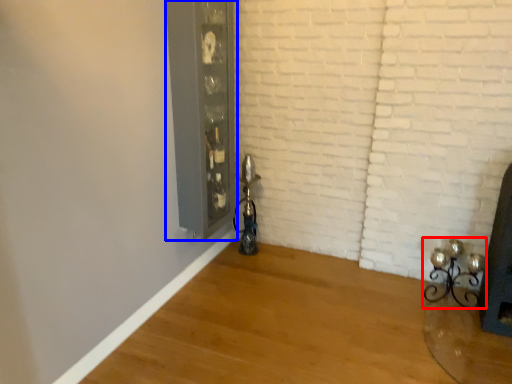
Question: Which object is further to the camera taking this photo, candle holder (highlighted by a red box) or glass door (highlighted by a blue box)?

Choices:
 (A) candle holder
 (B) glass door

Answer: (A)